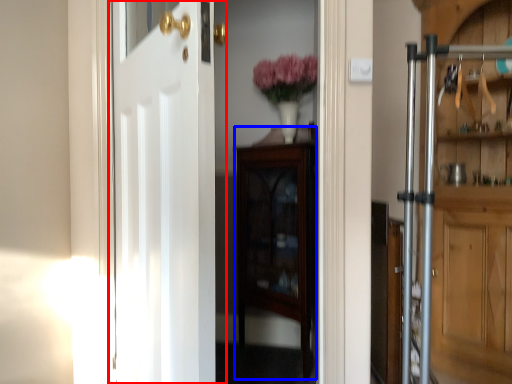
Question: Which point is closer to the camera, door (highlighted by a red box) or cabinetry (highlighted by a blue box)?

Choices:
 (A) door
 (B) cabinetry

Answer: (A)